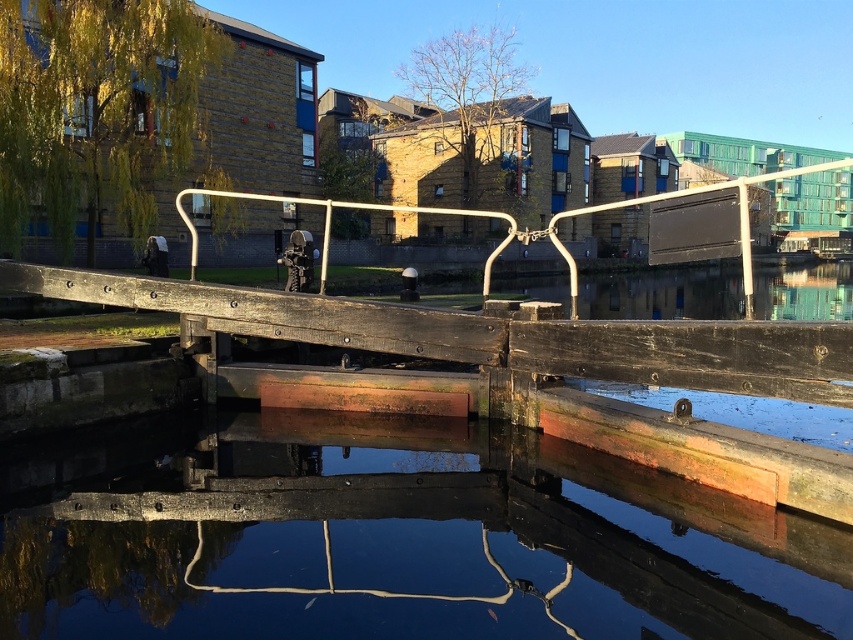
Question: Is smooth concrete water at center wider than white metal rail at center?

Choices:
 (A) yes
 (B) no

Answer: (B)

Question: Can you confirm if smooth concrete water at center is positioned below white metal rail at center?

Choices:
 (A) no
 (B) yes

Answer: (B)

Question: Can you confirm if smooth concrete water at center is positioned above white metal rail at center?

Choices:
 (A) yes
 (B) no

Answer: (B)

Question: Which point is farther from the camera taking this photo?

Choices:
 (A) (213, 192)
 (B) (332, 598)

Answer: (A)